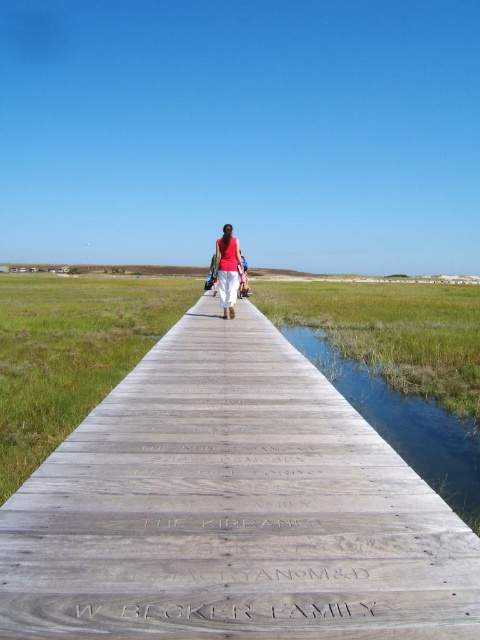
You are standing on the wooden boardwalk in the marsh. There is a point marked at coordinates (x=231, y=509). What object is located at that point?

The point at (x=231, y=509) marks the wooden boardwalk at center.

You are standing on the wooden boardwalk and want to take a photo of the green grassy salt marsh at center and the matte red shirt at center. Which object should you focus on first if you want to capture both in a single frame without moving the camera?

You should focus on the green grassy salt marsh at center first because it is larger in size compared to the matte red shirt at center, allowing it to be more prominently featured in the frame while still including the smaller matte red shirt at center.